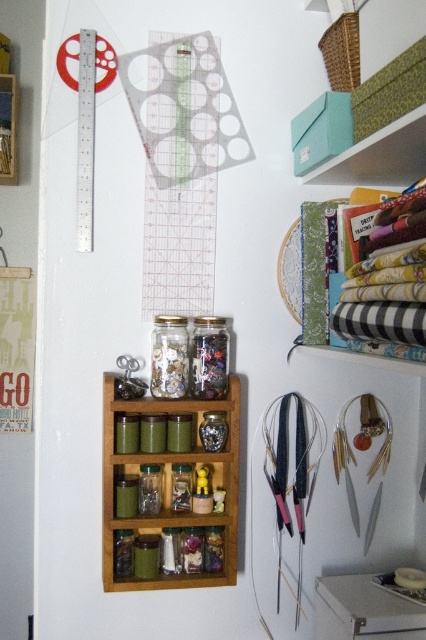
Between transparent plastic ruler at upper left and transparent glass jar at center, which one is positioned higher?

transparent plastic ruler at upper left is higher up.

From the picture: Does transparent plastic ruler at upper left appear over transparent glass jar at center?

Indeed, transparent plastic ruler at upper left is positioned over transparent glass jar at center.

Does point (86, 38) lie in front of point (186, 339)?

No, it is not.

Where is `transparent plastic ruler at upper left`? The width and height of the screenshot is (426, 640). transparent plastic ruler at upper left is located at coordinates (86, 140).

Between point (173, 321) and point (11, 145), which one is positioned in front?

Point (173, 321) is more forward.

Who is taller, transparent glass jar at center or wooden spice rack at upper left?

Standing taller between the two is wooden spice rack at upper left.

Image resolution: width=426 pixels, height=640 pixels. What are the coordinates of `transparent glass jar at center` in the screenshot? It's located at (169, 356).

Between wooden spice rack at center and transparent plastic ruler at upper left, which one has less height?

wooden spice rack at center is shorter.

Does wooden spice rack at center have a greater height compared to transparent plastic ruler at upper left?

In fact, wooden spice rack at center may be shorter than transparent plastic ruler at upper left.

Does point (132, 460) come closer to viewer compared to point (85, 192)?

That is True.

I want to click on wooden spice rack at center, so click(169, 484).